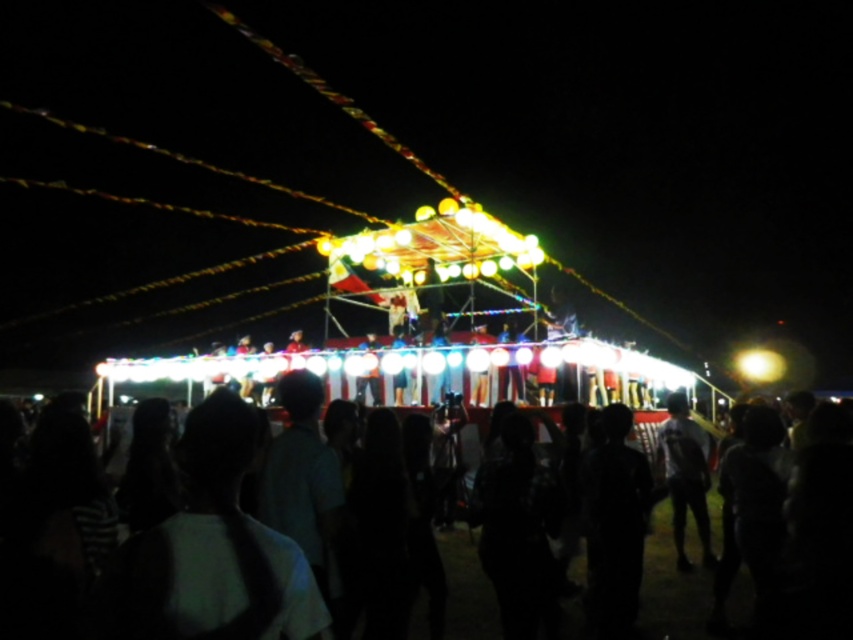
Question: Does black matte crowd at center appear over dark gray fabric shirt at center?

Choices:
 (A) yes
 (B) no

Answer: (B)

Question: Can you confirm if black matte crowd at center is positioned to the left of dark gray fabric shirt at center?

Choices:
 (A) yes
 (B) no

Answer: (A)

Question: Which of the following is the farthest from the observer?

Choices:
 (A) (675, 451)
 (B) (474, 573)

Answer: (A)

Question: Which object appears farthest from the camera in this image?

Choices:
 (A) dark gray fabric shirt at center
 (B) black matte crowd at center

Answer: (A)

Question: Is black matte crowd at center below dark gray fabric shirt at center?

Choices:
 (A) yes
 (B) no

Answer: (A)